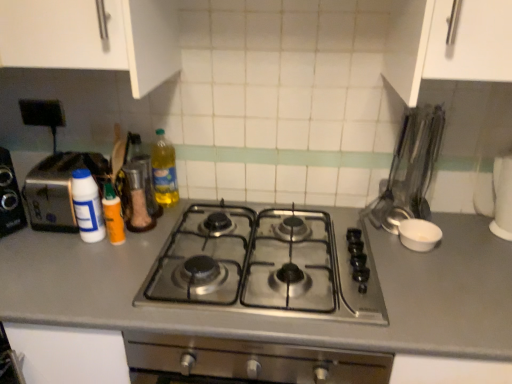
Where is `vacant area to the right of white matte bowl at right, the first appliance ordered from the bottom`? vacant area to the right of white matte bowl at right, the first appliance ordered from the bottom is located at coordinates click(467, 239).